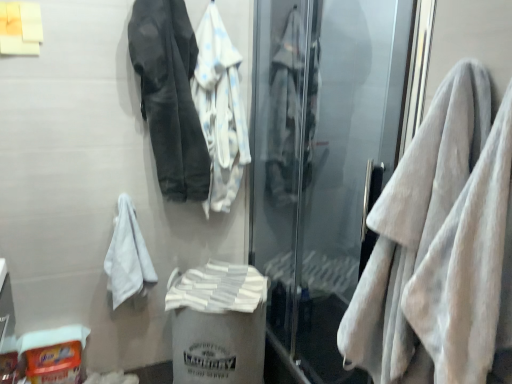
In order to click on white cotton jacket at upper center, marked as the 2th jacket in a left-to-right arrangement in this screenshot , I will do `click(220, 110)`.

What is the approximate width of white soft towel at left, marked as the 2th towel in a right-to-left arrangement?

8.58 inches.

Measure the distance between white soft bath towel at center and camera.

white soft bath towel at center is 1.85 meters from camera.

The width and height of the screenshot is (512, 384). Find the location of `white cotton jacket at upper center, the first jacket in the right-to-left sequence`. white cotton jacket at upper center, the first jacket in the right-to-left sequence is located at coordinates (220, 110).

Is point (211, 100) closer to camera compared to point (234, 267)?

Yes, point (211, 100) is closer to viewer.

Can you see white cotton jacket at upper center, marked as the 2th jacket in a left-to-right arrangement, touching white soft bath towel at center?

No.

Is white cotton jacket at upper center, the first jacket in the right-to-left sequence, facing towards white soft bath towel at center?

No, white cotton jacket at upper center, the first jacket in the right-to-left sequence, is not aimed at white soft bath towel at center.

Are white cotton towel at center and transparent glass screen door at right far apart?

They are positioned close to each other.

Does point (315, 61) appear closer or farther from the camera than point (353, 140)?

Clearly, point (315, 61) is closer to the camera than point (353, 140).

Which object is wider, white cotton towel at center or transparent glass screen door at right?

Wider between the two is white cotton towel at center.

Where is `towel that appears behind the white fluffy towel at right, which is the second towel from back to front`? This screenshot has height=384, width=512. towel that appears behind the white fluffy towel at right, which is the second towel from back to front is located at coordinates (127, 256).

Which is closer, (126,200) or (480,225)?

Point (126,200) appears to be farther away from the viewer than point (480,225).

From the image's perspective, between white soft towel at left, marked as the 2th towel in a right-to-left arrangement, and white fluffy towel at right, positioned as the 1th towel in right-to-left order, which one is located above?

From the image's view, white fluffy towel at right, positioned as the 1th towel in right-to-left order, is above.

Would you say white fluffy towel at right, which is the first towel from front to back, is part of white soft towel at left, which is the second towel from front to back,'s contents?

No, white fluffy towel at right, which is the first towel from front to back, is not a part of white soft towel at left, which is the second towel from front to back.

Which of these two, white fluffy towel at right, positioned as the 1th towel in right-to-left order, or white soft bath towel at center, stands shorter?

white soft bath towel at center is shorter.

Is white soft bath towel at center at the back of white fluffy towel at right, which is the second towel from back to front?

No, white fluffy towel at right, which is the second towel from back to front, is not facing away from white soft bath towel at center.

Considering the relative sizes of dark gray fabric jacket at upper left, the second jacket positioned from the right, and orange plastic bag at lower left, the 1th garbage when ordered from left to right, in the image provided, is dark gray fabric jacket at upper left, the second jacket positioned from the right, wider than orange plastic bag at lower left, the 1th garbage when ordered from left to right,?

Yes, dark gray fabric jacket at upper left, the second jacket positioned from the right, is wider than orange plastic bag at lower left, the 1th garbage when ordered from left to right.

From the image's perspective, is dark gray fabric jacket at upper left, the 1th jacket viewed from the left, located beneath orange plastic bag at lower left, the 1th garbage when ordered from left to right?

No, from the image's perspective, dark gray fabric jacket at upper left, the 1th jacket viewed from the left, is not below orange plastic bag at lower left, the 1th garbage when ordered from left to right.

Could you tell me if dark gray fabric jacket at upper left, the 1th jacket viewed from the left, is turned towards orange plastic bag at lower left, the 1th garbage when ordered from left to right?

No, dark gray fabric jacket at upper left, the 1th jacket viewed from the left, does not turn towards orange plastic bag at lower left, the 1th garbage when ordered from left to right.

From a real-world perspective, which is physically above, dark gray fabric jacket at upper left, the 1th jacket viewed from the left, or orange plastic bag at lower left, acting as the 2th garbage starting from the right?

dark gray fabric jacket at upper left, the 1th jacket viewed from the left.

Who is smaller, white cotton jacket at upper center, marked as the 2th jacket in a left-to-right arrangement, or transparent glass screen door at right?

With smaller size is white cotton jacket at upper center, marked as the 2th jacket in a left-to-right arrangement.

Is white cotton jacket at upper center, marked as the 2th jacket in a left-to-right arrangement, taller than transparent glass screen door at right?

In fact, white cotton jacket at upper center, marked as the 2th jacket in a left-to-right arrangement, may be shorter than transparent glass screen door at right.

Is there a large distance between white cotton jacket at upper center, the first jacket in the right-to-left sequence, and transparent glass screen door at right?

No.

Can transparent glass screen door at right be found inside white cotton jacket at upper center, the first jacket in the right-to-left sequence?

No, white cotton jacket at upper center, the first jacket in the right-to-left sequence, does not contain transparent glass screen door at right.

From the picture: From the image's perspective, between orange plastic bag at lower left, the 1th garbage when ordered from left to right, and transparent glass screen door at right, who is located below?

From the image's view, orange plastic bag at lower left, the 1th garbage when ordered from left to right, is below.

What's the angular difference between orange plastic bag at lower left, the 1th garbage when ordered from left to right, and transparent glass screen door at right's facing directions?

orange plastic bag at lower left, the 1th garbage when ordered from left to right, and transparent glass screen door at right are facing 92.3 degrees away from each other.

Does orange plastic bag at lower left, the 1th garbage when ordered from left to right, have a lesser width compared to transparent glass screen door at right?

In fact, orange plastic bag at lower left, the 1th garbage when ordered from left to right, might be wider than transparent glass screen door at right.

In terms of size, does orange plastic bag at lower left, acting as the 2th garbage starting from the right, appear bigger or smaller than transparent glass screen door at right?

Considering their sizes, orange plastic bag at lower left, acting as the 2th garbage starting from the right, takes up less space than transparent glass screen door at right.

Where is `bath towel behind the white cotton jacket at upper center, marked as the 2th jacket in a left-to-right arrangement`? Image resolution: width=512 pixels, height=384 pixels. bath towel behind the white cotton jacket at upper center, marked as the 2th jacket in a left-to-right arrangement is located at coordinates (217, 288).

This screenshot has width=512, height=384. Find the location of `screen door below the white cotton towel at center (from a real-world perspective)`. screen door below the white cotton towel at center (from a real-world perspective) is located at coordinates (321, 165).

Based on the photo, estimate the real-world distances between objects in this image. Which object is further from orange plastic bag at lower left, acting as the 2th garbage starting from the right, white soft bath towel at center or transparent glass screen door at right?

The object further to orange plastic bag at lower left, acting as the 2th garbage starting from the right, is transparent glass screen door at right.

Based on their spatial positions, is white cotton jacket at upper center, the first jacket in the right-to-left sequence, or white fluffy towel at right, the second towel viewed from the left, further from transparent glass screen door at right?

white fluffy towel at right, the second towel viewed from the left, is positioned further to the anchor transparent glass screen door at right.

Based on their spatial positions, is white soft towel at left, which is the second towel from front to back, or white cotton jacket at upper center, the first jacket in the right-to-left sequence, further from orange plastic bag at lower left, the 1th garbage when ordered from left to right?

Among the two, white cotton jacket at upper center, the first jacket in the right-to-left sequence, is located further to orange plastic bag at lower left, the 1th garbage when ordered from left to right.

Looking at this image, estimate the real-world distances between objects in this image. Which object is closer to white plastic bag at center, positioned as the 1th garbage in right-to-left order, orange plastic bag at lower left, acting as the 2th garbage starting from the right, or white cotton towel at center?

Based on the image, orange plastic bag at lower left, acting as the 2th garbage starting from the right, appears to be nearer to white plastic bag at center, positioned as the 1th garbage in right-to-left order.

When comparing their distances from white soft bath towel at center, does dark gray fabric jacket at upper left, the 1th jacket viewed from the left, or white cotton towel at center seem further?

The object further to white soft bath towel at center is white cotton towel at center.

From the image, which object appears to be nearer to white cotton jacket at upper center, marked as the 2th jacket in a left-to-right arrangement, orange plastic bag at lower left, the 1th garbage when ordered from left to right, or white soft bath towel at center?

The object closer to white cotton jacket at upper center, marked as the 2th jacket in a left-to-right arrangement, is white soft bath towel at center.

Considering their positions, is white cotton towel at center positioned further to white plastic bag at center, arranged as the second garbage when viewed from the left, than dark gray fabric jacket at upper left, the 1th jacket viewed from the left?

white cotton towel at center is further to white plastic bag at center, arranged as the second garbage when viewed from the left.

In the scene shown: Based on their spatial positions, is white fluffy towel at right, positioned as the 1th towel in right-to-left order, or white soft bath towel at center closer to white plastic bag at center, arranged as the second garbage when viewed from the left?

Among the two, white soft bath towel at center is located nearer to white plastic bag at center, arranged as the second garbage when viewed from the left.

Locate an element on the screen. This screenshot has width=512, height=384. garbage between white cotton towel at center and orange plastic bag at lower left, acting as the 2th garbage starting from the right, in the up-down direction is located at coordinates (218, 323).

Find the location of a particular element. Image resolution: width=512 pixels, height=384 pixels. jacket between transparent glass screen door at right and white cotton jacket at upper center, the first jacket in the right-to-left sequence, from front to back is located at coordinates (170, 96).

The height and width of the screenshot is (384, 512). What are the coordinates of `garbage between transparent glass screen door at right and white soft bath towel at center along the z-axis` in the screenshot? It's located at (218, 323).

Find the location of a particular element. The image size is (512, 384). screen door that lies between dark gray fabric jacket at upper left, the 1th jacket viewed from the left, and white plastic bag at center, arranged as the second garbage when viewed from the left, from top to bottom is located at coordinates (321, 165).